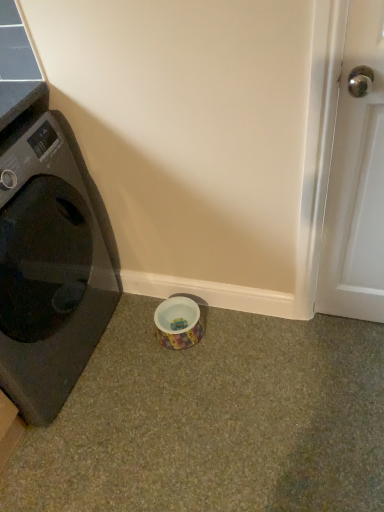
Image resolution: width=384 pixels, height=512 pixels. In order to click on vacant space situated on the left part of white glossy door handle at right in this screenshot , I will do `click(305, 339)`.